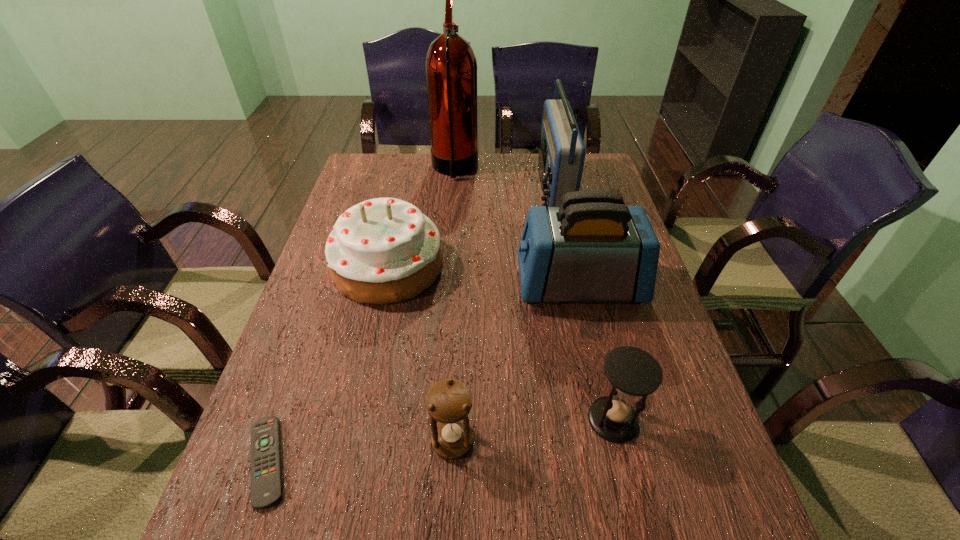
This screenshot has width=960, height=540. Identify the location of cake that is at the left edge. (383, 250).

Where is `remote control at the left edge`? remote control at the left edge is located at coordinates (266, 476).

Find the location of `radio receiver that is at the right edge`. radio receiver that is at the right edge is located at coordinates (561, 157).

The height and width of the screenshot is (540, 960). I want to click on toaster positioned at the right edge, so point(593,248).

Find the location of a particular element. The image size is (960, 540). hourglass located at the right edge is located at coordinates (632, 371).

The height and width of the screenshot is (540, 960). In order to click on object at the far right corner in this screenshot , I will do `click(561, 157)`.

Identify the location of free space at the far edge of the desktop. The width and height of the screenshot is (960, 540). (496, 161).

Where is `free space at the left edge of the desktop`? Image resolution: width=960 pixels, height=540 pixels. free space at the left edge of the desktop is located at coordinates (300, 433).

The width and height of the screenshot is (960, 540). In order to click on free space at the far left corner of the desktop in this screenshot , I will do `click(398, 156)`.

Find the location of a particular element. The height and width of the screenshot is (540, 960). free space between the toaster and the right hourglass is located at coordinates coord(596,352).